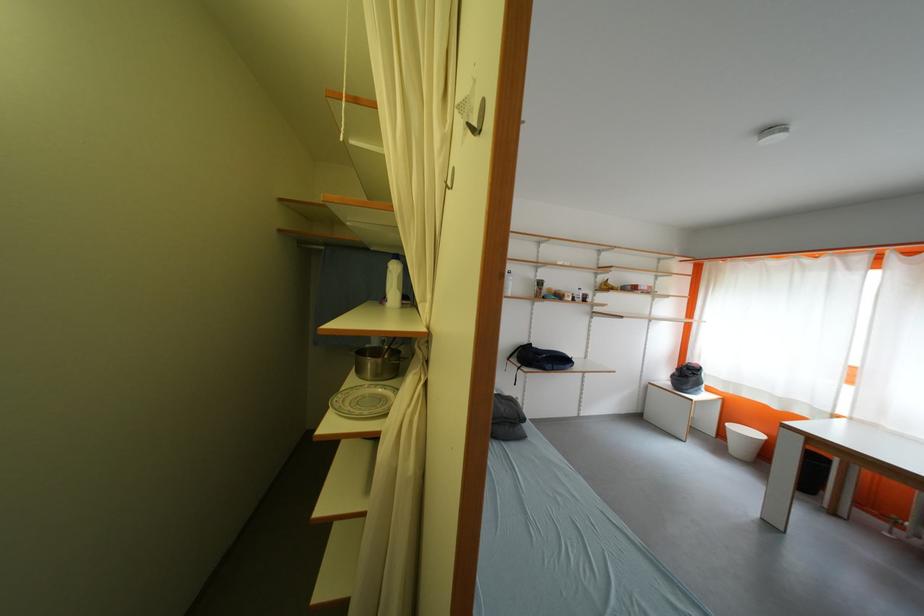
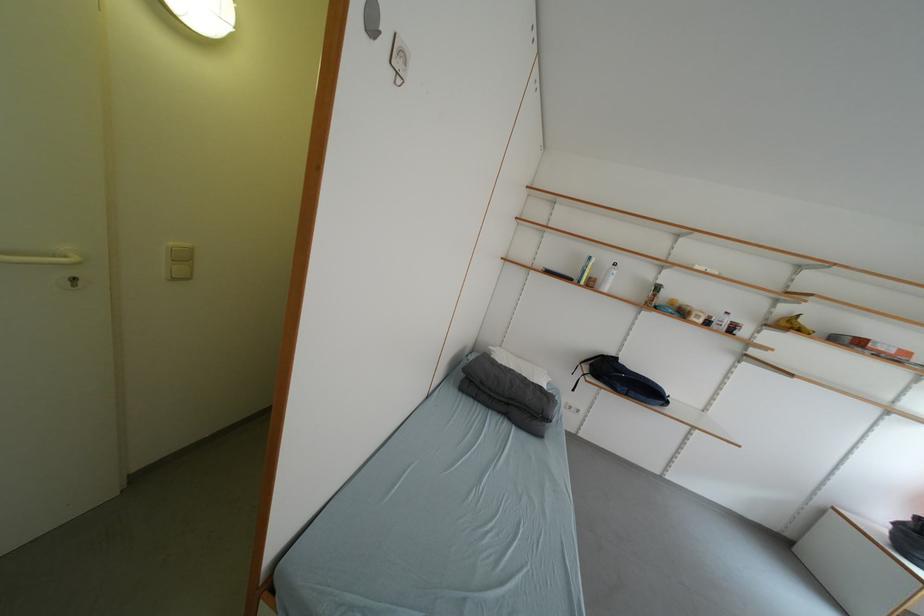
Locate, in the second image, the point that corresponds to the point at 564,370 in the first image.

(640, 395)